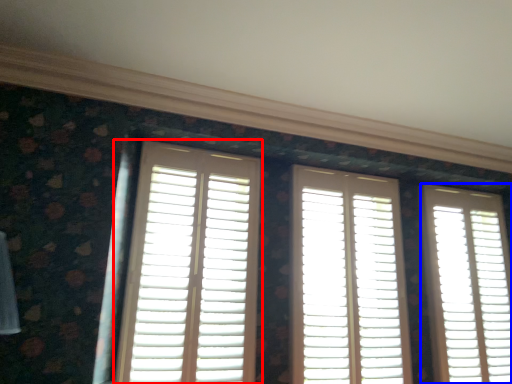
Question: Among these objects, which one is farthest to the camera, window (highlighted by a red box) or window (highlighted by a blue box)?

Choices:
 (A) window
 (B) window

Answer: (B)